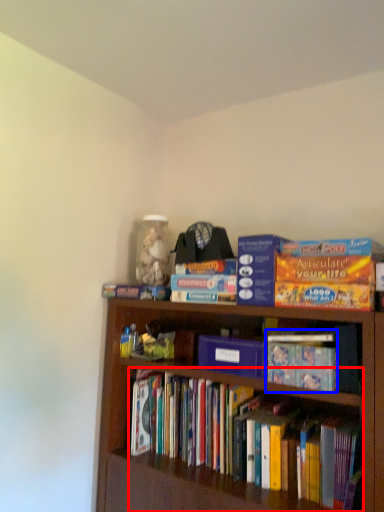
Question: Which point is closer to the camera, book (highlighted by a red box) or book (highlighted by a blue box)?

Choices:
 (A) book
 (B) book

Answer: (A)